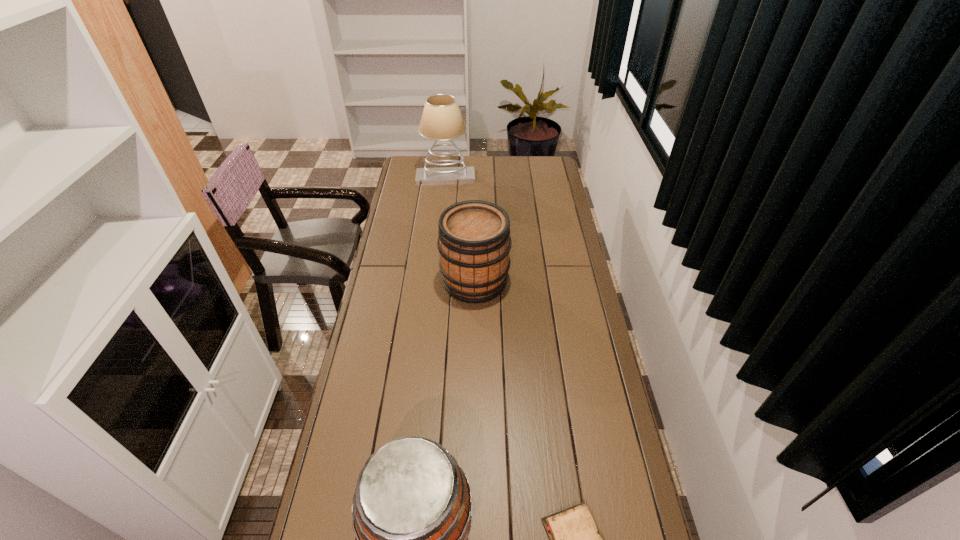
Identify the location of the farthest object. (441, 120).

You are a GUI agent. You are given a task and a screenshot of the screen. Output one action in this format:
    pyautogui.click(x=<x>, y=<y>)
    Task: Click on the table lamp
    The width and height of the screenshot is (960, 540).
    Given the screenshot: What is the action you would take?
    [x=441, y=120]

Locate an element on the screen. the third nearest object is located at coordinates (474, 242).

You are a GUI agent. You are given a task and a screenshot of the screen. Output one action in this format:
    pyautogui.click(x=<x>, y=<y>)
    Task: Click on the blank space located 0.370m on the front of the tallest object
    
    Given the screenshot: What is the action you would take?
    pyautogui.click(x=440, y=232)

I want to click on free location located 0.220m on the left of the farther cider, so click(387, 281).

Find the location of `object at the far edge`. object at the far edge is located at coordinates (441, 120).

You are a GUI agent. You are given a task and a screenshot of the screen. Output one action in this format:
    pyautogui.click(x=<x>, y=<y>)
    Task: Click on the object present at the left edge
    This screenshot has width=960, height=540.
    Given the screenshot: What is the action you would take?
    pyautogui.click(x=441, y=120)

What are the coordinates of `object that is at the far left corner` in the screenshot? It's located at (441, 120).

Identify the location of free space at the far edge of the desktop. (493, 166).

This screenshot has height=540, width=960. Identify the location of vacant space at the left edge of the desktop. (397, 194).